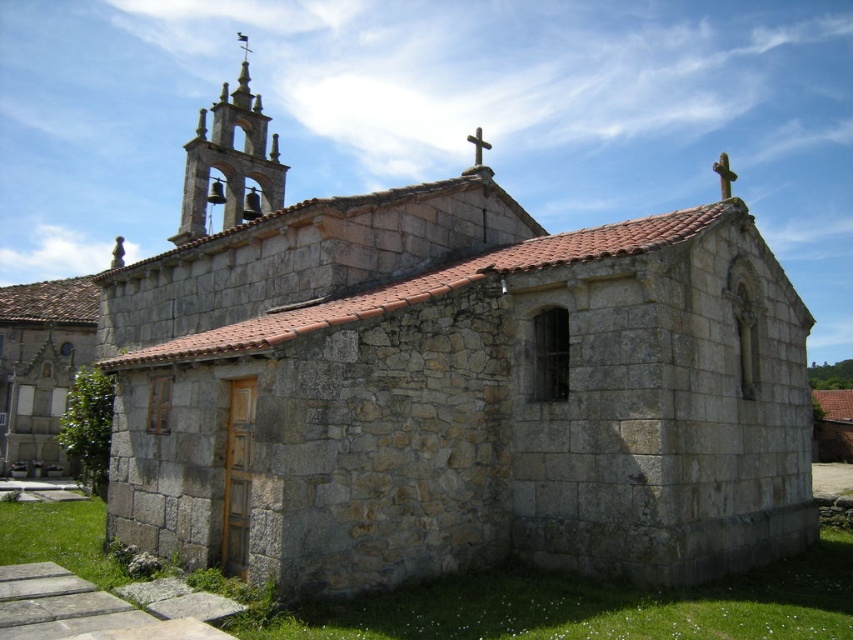
Can you confirm if stone bell tower at upper left is smaller than smooth stone cross at upper right?

Correct, stone bell tower at upper left occupies less space than smooth stone cross at upper right.

Which is more to the left, stone bell tower at upper left or smooth stone cross at upper right?

stone bell tower at upper left

What do you see at coordinates (229, 163) in the screenshot?
I see `stone bell tower at upper left` at bounding box center [229, 163].

Where is `stone bell tower at upper left`? This screenshot has width=853, height=640. stone bell tower at upper left is located at coordinates (229, 163).

Based on the photo, is metallic cross at center further to the viewer compared to metallic cross at upper center?

→ No, it is not.

Between metallic cross at center and metallic cross at upper center, which one is positioned lower?

metallic cross at center is lower down.

Where is `metallic cross at center`? Image resolution: width=853 pixels, height=640 pixels. metallic cross at center is located at coordinates (479, 145).

Does stone bell tower at upper left come behind metallic cross at upper center?

No.

Is point (257, 202) behind point (248, 42)?

That is False.

This screenshot has width=853, height=640. I want to click on stone bell tower at upper left, so tap(229, 163).